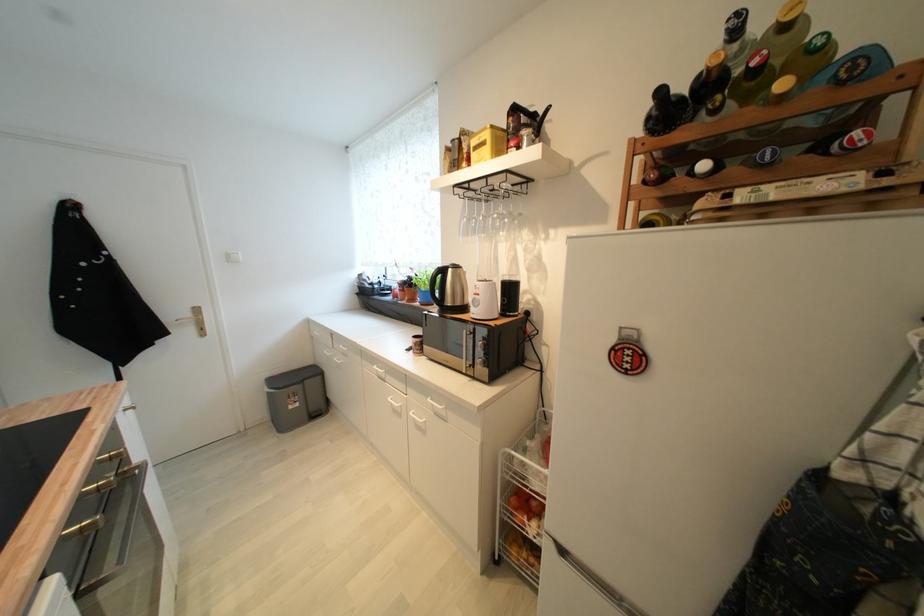
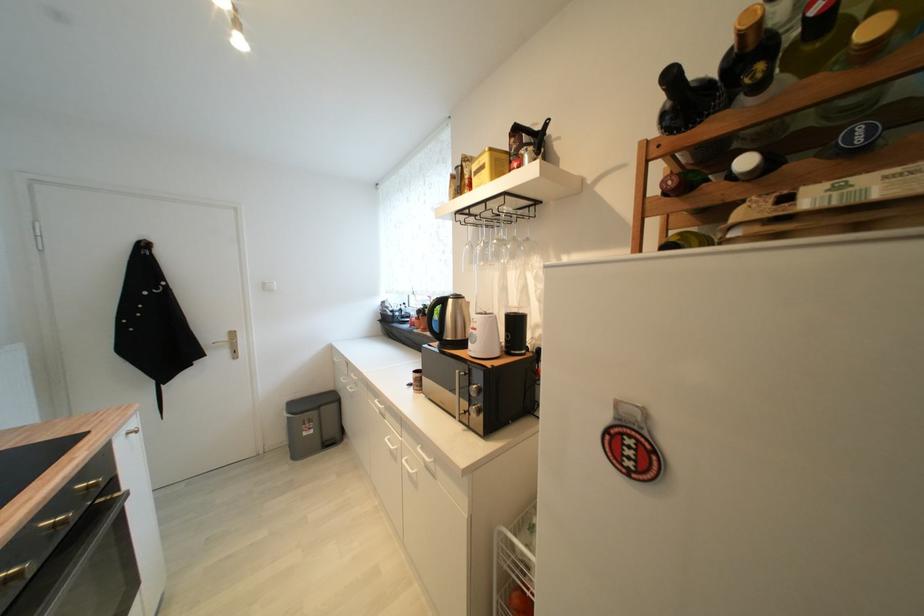
Locate, in the second image, the point that corresponds to the point at 526,216 in the first image.

(532, 241)